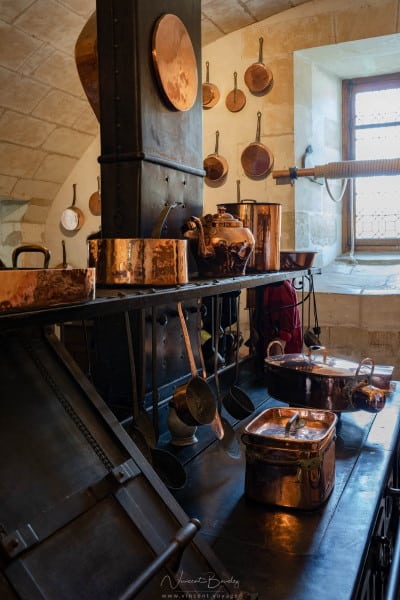
Find the location of `window`. window is located at coordinates (378, 201), (386, 135), (384, 104).